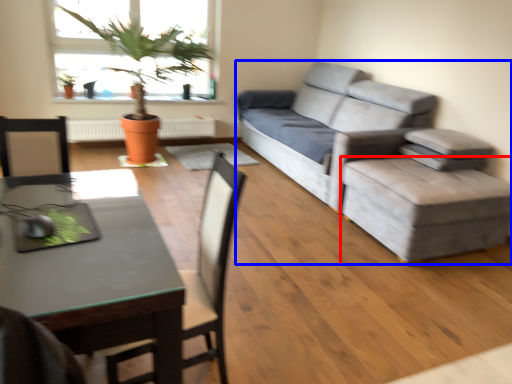
Question: Which point is further to the camera, stool (highlighted by a red box) or studio couch (highlighted by a blue box)?

Choices:
 (A) stool
 (B) studio couch

Answer: (B)